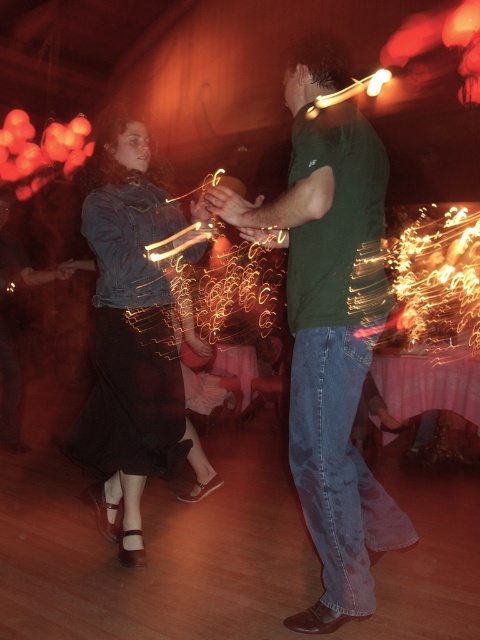
Question: Where is green matte shirt at center located in relation to denim jacket at left in the image?

Choices:
 (A) left
 (B) right

Answer: (B)

Question: Is green matte shirt at center to the left of denim jacket at left from the viewer's perspective?

Choices:
 (A) yes
 (B) no

Answer: (B)

Question: Which object is closer to the camera taking this photo?

Choices:
 (A) green matte shirt at center
 (B) denim jacket at left

Answer: (A)

Question: Which point appears closest to the camera in this image?

Choices:
 (A) (109, 508)
 (B) (384, 276)

Answer: (B)

Question: Is green matte shirt at center closer to the viewer compared to denim jacket at left?

Choices:
 (A) yes
 (B) no

Answer: (A)